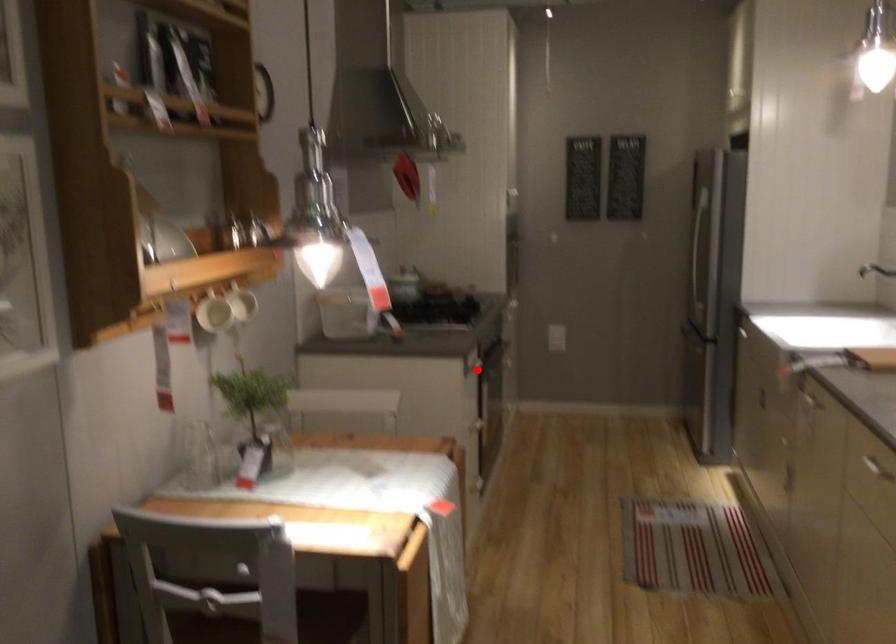
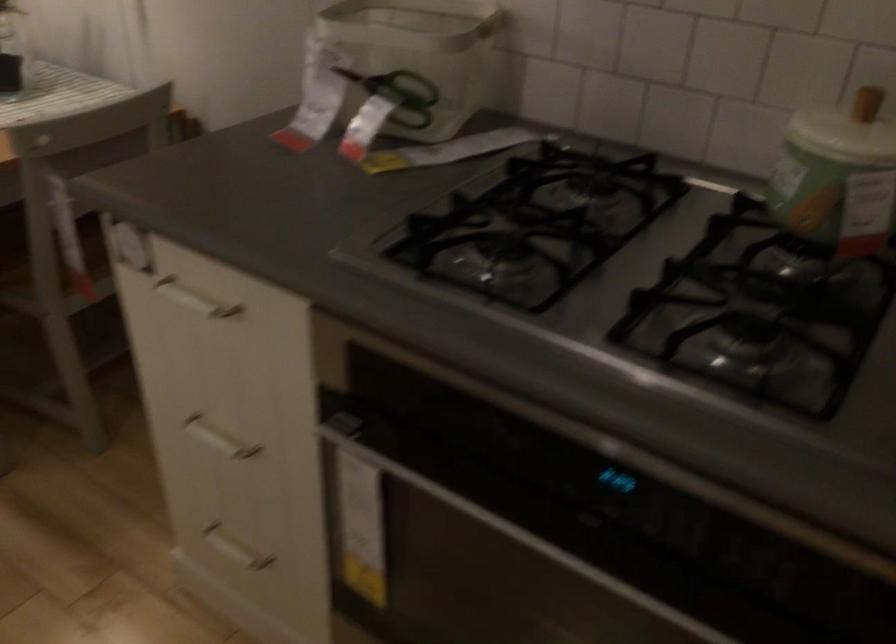
Question: I am providing you with two images of the same scene from different viewpoints. In image1, a red point is highlighted. Considering the same 3D point in image2, which of the following is correct?

Choices:
 (A) It is closer
 (B) It is farther

Answer: (A)